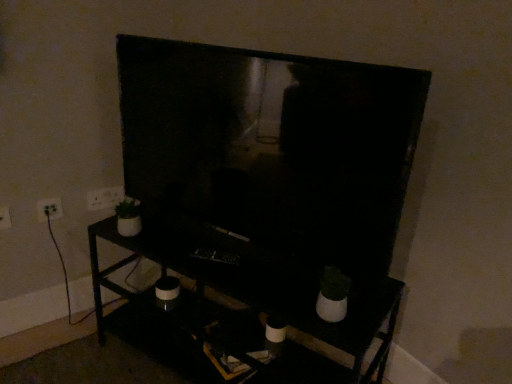
The width and height of the screenshot is (512, 384). Describe the element at coordinates (253, 283) in the screenshot. I see `black matte tv stand at center` at that location.

The width and height of the screenshot is (512, 384). Identify the location of black matte tv stand at center. coord(253,283).

Where is `furniture that appears on the right of white plastic electric outlet at upper left, the 1th electric outlet viewed from the right`? The width and height of the screenshot is (512, 384). furniture that appears on the right of white plastic electric outlet at upper left, the 1th electric outlet viewed from the right is located at coordinates (253, 283).

Is black matte tv stand at center inside or outside of white plastic electric outlet at upper left, the 1th electric outlet viewed from the right?

black matte tv stand at center is located beyond the bounds of white plastic electric outlet at upper left, the 1th electric outlet viewed from the right.

Is black matte tv stand at center wider or thinner than white plastic electric outlet at upper left, marked as the 3th electric outlet in a front-to-back arrangement?

black matte tv stand at center is wider than white plastic electric outlet at upper left, marked as the 3th electric outlet in a front-to-back arrangement.

Is black matte tv stand at center bigger than white plastic electric outlet at upper left, the 1th electric outlet viewed from the right?

Indeed, black matte tv stand at center has a larger size compared to white plastic electric outlet at upper left, the 1th electric outlet viewed from the right.

Which object is wider, matte black tv at center or white plastic electric outlet at left, which appears as the 2th electric outlet when viewed from the left?

matte black tv at center.

What's the angular difference between matte black tv at center and white plastic electric outlet at left, which appears as the 2th electric outlet when viewed from the left,'s facing directions?

There is a 68.9-degree angle between the facing directions of matte black tv at center and white plastic electric outlet at left, which appears as the 2th electric outlet when viewed from the left.

Would you say matte black tv at center contains white plastic electric outlet at left, which is the 2th electric outlet in back-to-front order?

No, white plastic electric outlet at left, which is the 2th electric outlet in back-to-front order, is not inside matte black tv at center.

Between matte black tv at center and white plastic electric outlet at left, marked as the second electric outlet in a right-to-left arrangement, which one appears on the left side from the viewer's perspective?

Positioned to the left is white plastic electric outlet at left, marked as the second electric outlet in a right-to-left arrangement.

Is white plastic electric outlet at left, which is the 2th electric outlet in back-to-front order, in contact with matte black tv at center?

No, white plastic electric outlet at left, which is the 2th electric outlet in back-to-front order, is not next to matte black tv at center.

Does point (46, 210) appear closer or farther from the camera than point (352, 143)?

Point (46, 210) is farther from the camera than point (352, 143).

Is white plastic electric outlet at left, which is the 2th electric outlet in back-to-front order, positioned with its back to matte black tv at center?

white plastic electric outlet at left, which is the 2th electric outlet in back-to-front order, does not have its back to matte black tv at center.

Is white plastic electric outlet at left, marked as the second electric outlet in a right-to-left arrangement, at the right side of matte black tv at center?

In fact, white plastic electric outlet at left, marked as the second electric outlet in a right-to-left arrangement, is to the left of matte black tv at center.

Is the position of white plastic electric outlet at left, positioned as the second electric outlet in front-to-back order, more distant than that of white plastic electric outlet at left, the 1th electric outlet positioned from the front?

Yes, it is behind white plastic electric outlet at left, the 1th electric outlet positioned from the front.

Locate an element on the screen. This screenshot has height=384, width=512. the 1st electric outlet located above the white plastic electric outlet at left, marked as the second electric outlet in a right-to-left arrangement (from a real-world perspective) is located at coordinates (5, 218).

Could you tell me if white plastic electric outlet at left, marked as the second electric outlet in a right-to-left arrangement, is facing white plastic electric outlet at left, the third electric outlet positioned from the right?

No, white plastic electric outlet at left, marked as the second electric outlet in a right-to-left arrangement, is not turned towards white plastic electric outlet at left, the third electric outlet positioned from the right.

Would you say white plastic electric outlet at left, marked as the second electric outlet in a right-to-left arrangement, is inside or outside white plastic electric outlet at left, acting as the first electric outlet starting from the left?

white plastic electric outlet at left, marked as the second electric outlet in a right-to-left arrangement, cannot be found inside white plastic electric outlet at left, acting as the first electric outlet starting from the left.

From the image's perspective, who appears lower, matte black tv at center or white plastic electric outlet at left, acting as the 3th electric outlet starting from the back?

white plastic electric outlet at left, acting as the 3th electric outlet starting from the back, is shown below in the image.

Which object is closer to the camera, matte black tv at center or white plastic electric outlet at left, the 1th electric outlet positioned from the front?

matte black tv at center.

From a real-world perspective, who is located lower, matte black tv at center or white plastic electric outlet at left, acting as the 3th electric outlet starting from the back?

white plastic electric outlet at left, acting as the 3th electric outlet starting from the back, from a real-world perspective.

From the image's perspective, which object appears higher, black matte tv stand at center or white plastic electric outlet at left, acting as the first electric outlet starting from the left?

white plastic electric outlet at left, acting as the first electric outlet starting from the left, from the image's perspective.

Consider the image. Which of these two, black matte tv stand at center or white plastic electric outlet at left, the 1th electric outlet positioned from the front, stands shorter?

Standing shorter between the two is white plastic electric outlet at left, the 1th electric outlet positioned from the front.

Which is behind, point (384, 360) or point (1, 228)?

Point (1, 228)

From a real-world perspective, is black matte tv stand at center on white plastic electric outlet at left, acting as the first electric outlet starting from the left?

Actually, black matte tv stand at center is physically below white plastic electric outlet at left, acting as the first electric outlet starting from the left, in the real world.

Could white plastic electric outlet at left, marked as the second electric outlet in a right-to-left arrangement, be considered to be inside white plastic electric outlet at upper left, the 1th electric outlet viewed from the right?

No, white plastic electric outlet at upper left, the 1th electric outlet viewed from the right, does not contain white plastic electric outlet at left, marked as the second electric outlet in a right-to-left arrangement.

From the image's perspective, is white plastic electric outlet at upper left, the first electric outlet in the back-to-front sequence, located above white plastic electric outlet at left, which is the 2th electric outlet in back-to-front order?

Yes, from the image's perspective, white plastic electric outlet at upper left, the first electric outlet in the back-to-front sequence, is above white plastic electric outlet at left, which is the 2th electric outlet in back-to-front order.

Can you tell me how much white plastic electric outlet at upper left, the first electric outlet in the back-to-front sequence, and white plastic electric outlet at left, which is the 2th electric outlet in back-to-front order, differ in facing direction?

0.0493 degrees separate the facing orientations of white plastic electric outlet at upper left, the first electric outlet in the back-to-front sequence, and white plastic electric outlet at left, which is the 2th electric outlet in back-to-front order.

Considering the sizes of white plastic electric outlet at upper left, which appears as the 3th electric outlet when viewed from the left, and white plastic electric outlet at left, positioned as the second electric outlet in front-to-back order, in the image, is white plastic electric outlet at upper left, which appears as the 3th electric outlet when viewed from the left, wider or thinner than white plastic electric outlet at left, positioned as the second electric outlet in front-to-back order,?

Clearly, white plastic electric outlet at upper left, which appears as the 3th electric outlet when viewed from the left, has less width compared to white plastic electric outlet at left, positioned as the second electric outlet in front-to-back order.

I want to click on furniture below the white plastic electric outlet at upper left, marked as the 3th electric outlet in a front-to-back arrangement (from the image's perspective), so click(x=253, y=283).

This screenshot has width=512, height=384. I want to click on television in front of the white plastic electric outlet at left, positioned as the second electric outlet in front-to-back order, so click(x=273, y=144).

Looking at the image, which one is located further to black matte tv stand at center, matte black tv at center or white plastic electric outlet at left, which appears as the 2th electric outlet when viewed from the left?

Based on the image, white plastic electric outlet at left, which appears as the 2th electric outlet when viewed from the left, appears to be further to black matte tv stand at center.

In the scene shown: Which object lies nearer to the anchor point white plastic electric outlet at left, the third electric outlet positioned from the right, white plastic electric outlet at upper left, which appears as the 3th electric outlet when viewed from the left, or black matte tv stand at center?

white plastic electric outlet at upper left, which appears as the 3th electric outlet when viewed from the left, lies closer to white plastic electric outlet at left, the third electric outlet positioned from the right, than the other object.

Based on their spatial positions, is matte black tv at center or white plastic electric outlet at left, acting as the 3th electric outlet starting from the back, further from black matte tv stand at center?

white plastic electric outlet at left, acting as the 3th electric outlet starting from the back, is positioned further to the anchor black matte tv stand at center.

When comparing their distances from white plastic electric outlet at upper left, marked as the 3th electric outlet in a front-to-back arrangement, does white plastic electric outlet at left, marked as the second electric outlet in a right-to-left arrangement, or white plastic electric outlet at left, the third electric outlet positioned from the right, seem closer?

white plastic electric outlet at left, marked as the second electric outlet in a right-to-left arrangement, is positioned closer to the anchor white plastic electric outlet at upper left, marked as the 3th electric outlet in a front-to-back arrangement.

Which object lies nearer to the anchor point black matte tv stand at center, white plastic electric outlet at left, positioned as the second electric outlet in front-to-back order, or white plastic electric outlet at upper left, the first electric outlet in the back-to-front sequence?

Based on the image, white plastic electric outlet at upper left, the first electric outlet in the back-to-front sequence, appears to be nearer to black matte tv stand at center.

Estimate the real-world distances between objects in this image. Which object is closer to white plastic electric outlet at left, positioned as the second electric outlet in front-to-back order, white plastic electric outlet at left, acting as the first electric outlet starting from the left, or matte black tv at center?

Among the two, white plastic electric outlet at left, acting as the first electric outlet starting from the left, is located nearer to white plastic electric outlet at left, positioned as the second electric outlet in front-to-back order.

When comparing their distances from black matte tv stand at center, does white plastic electric outlet at upper left, which appears as the 3th electric outlet when viewed from the left, or white plastic electric outlet at left, the third electric outlet positioned from the right, seem further?

white plastic electric outlet at left, the third electric outlet positioned from the right.

Estimate the real-world distances between objects in this image. Which object is further from white plastic electric outlet at upper left, the first electric outlet in the back-to-front sequence, black matte tv stand at center or white plastic electric outlet at left, acting as the first electric outlet starting from the left?

black matte tv stand at center is further to white plastic electric outlet at upper left, the first electric outlet in the back-to-front sequence.

The width and height of the screenshot is (512, 384). Identify the location of furniture between white plastic electric outlet at left, the third electric outlet positioned from the right, and matte black tv at center from left to right. (253, 283).

I want to click on electric outlet between white plastic electric outlet at left, the third electric outlet positioned from the right, and white plastic electric outlet at upper left, marked as the 3th electric outlet in a front-to-back arrangement, in the horizontal direction, so click(49, 209).

You are a GUI agent. You are given a task and a screenshot of the screen. Output one action in this format:
    pyautogui.click(x=<x>, y=<y>)
    Task: Click on the furniture between matte black tv at center and white plastic electric outlet at upper left, the 1th electric outlet viewed from the right, from front to back
    The image size is (512, 384).
    Given the screenshot: What is the action you would take?
    pyautogui.click(x=253, y=283)

Identify the location of furniture between white plastic electric outlet at left, marked as the second electric outlet in a right-to-left arrangement, and matte black tv at center, in the horizontal direction. (253, 283).